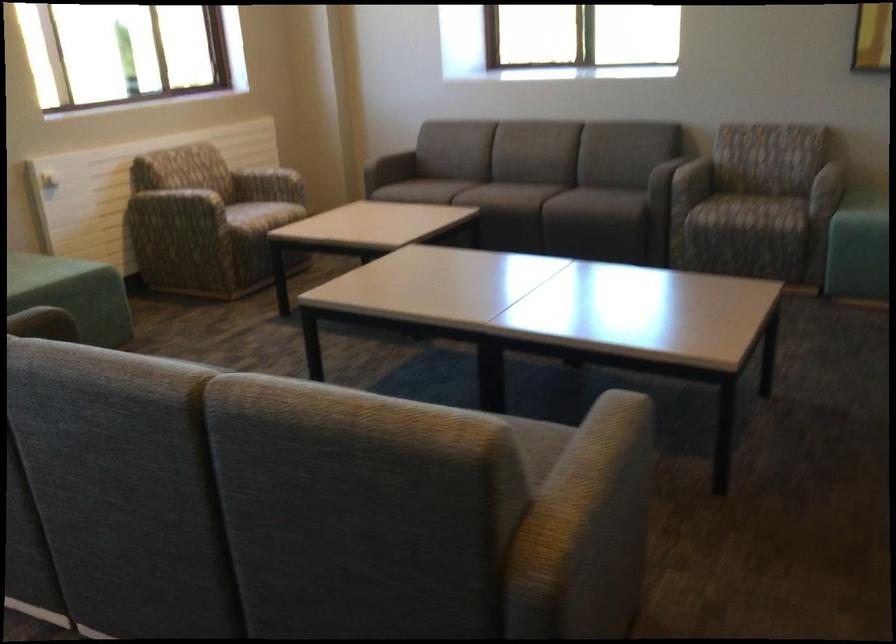
What do you see at coordinates (455, 187) in the screenshot?
I see `a sofa sitting surface` at bounding box center [455, 187].